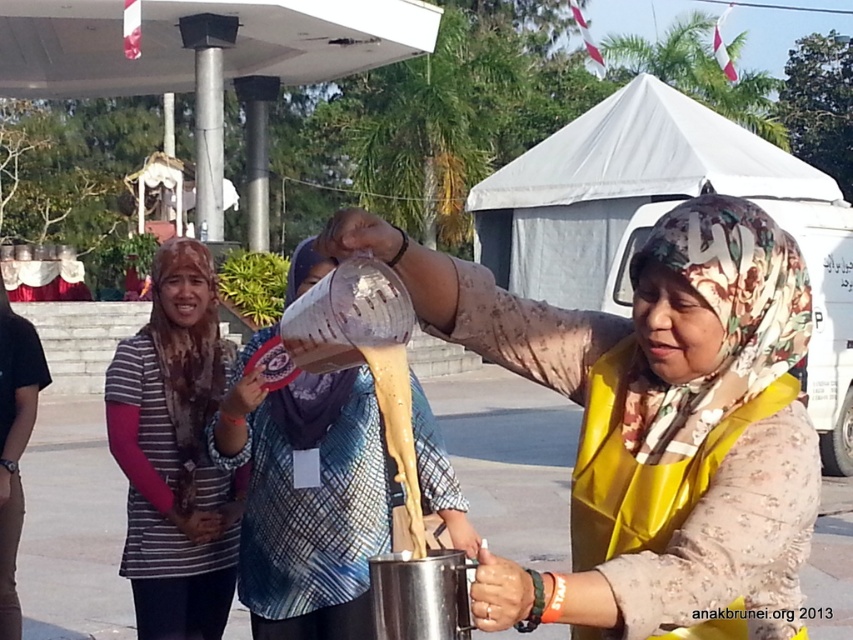
The height and width of the screenshot is (640, 853). Describe the element at coordinates (308, 500) in the screenshot. I see `matte plastic container at center` at that location.

Does matte plastic container at center have a lesser width compared to striped fabric headscarf at center?

In fact, matte plastic container at center might be wider than striped fabric headscarf at center.

Is point (239, 586) positioned behind point (192, 285)?

No, (239, 586) is closer to viewer.

Locate an element on the screen. The height and width of the screenshot is (640, 853). matte plastic container at center is located at coordinates (308, 500).

Between point (508, 576) and point (165, 300), which one is positioned in front?

Positioned in front is point (508, 576).

Is matte yellow apron at center bigger than striped fabric headscarf at center?

Indeed, matte yellow apron at center has a larger size compared to striped fabric headscarf at center.

Which is in front, point (634, 490) or point (160, 620)?

Point (634, 490)

Locate an element on the screen. matte yellow apron at center is located at coordinates (653, 424).

Which is behind, point (410, 253) or point (430, 435)?

Point (430, 435)

Does matte yellow apron at center appear under matte plastic container at center?

No.

Which is behind, point (756, 307) or point (282, 429)?

The point (282, 429) is behind.

Locate an element on the screen. Image resolution: width=853 pixels, height=640 pixels. matte yellow apron at center is located at coordinates (653, 424).